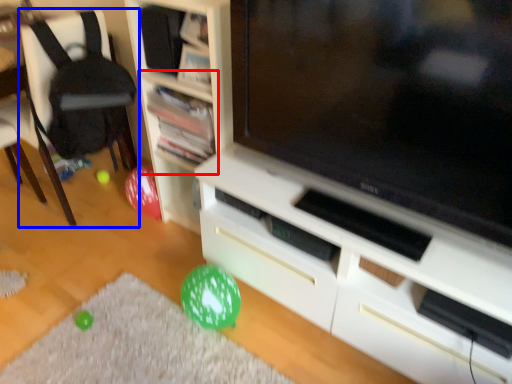
Question: Which object appears closest to the camera in this image, shelf (highlighted by a red box) or chair (highlighted by a blue box)?

Choices:
 (A) shelf
 (B) chair

Answer: (B)